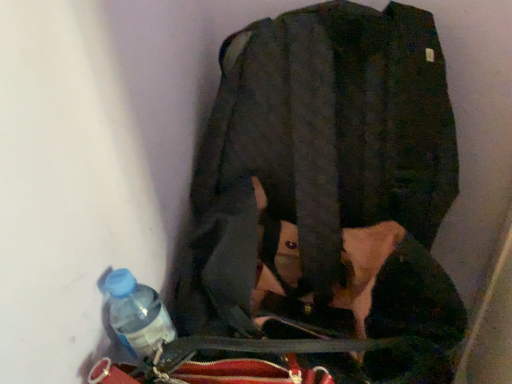
Question: Is translucent plastic bottle at lower left bigger or smaller than matte black jacket at center?

Choices:
 (A) big
 (B) small

Answer: (B)

Question: Is translucent plastic bottle at lower left wider or thinner than matte black jacket at center?

Choices:
 (A) wide
 (B) thin

Answer: (B)

Question: Relative to matte black jacket at center, is translucent plastic bottle at lower left in front or behind?

Choices:
 (A) behind
 (B) front

Answer: (A)

Question: Considering their positions, is matte black jacket at center located in front of or behind translucent plastic bottle at lower left?

Choices:
 (A) behind
 (B) front

Answer: (B)

Question: Does point (395, 46) appear closer or farther from the camera than point (168, 334)?

Choices:
 (A) farther
 (B) closer

Answer: (A)

Question: Do you think matte black jacket at center is within translucent plastic bottle at lower left, or outside of it?

Choices:
 (A) inside
 (B) outside

Answer: (B)

Question: Considering the positions of matte black jacket at center and translucent plastic bottle at lower left in the image, is matte black jacket at center wider or thinner than translucent plastic bottle at lower left?

Choices:
 (A) wide
 (B) thin

Answer: (A)